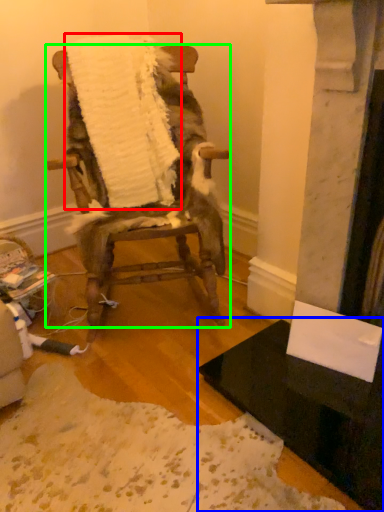
Question: Estimate the real-world distances between objects in this image. Which object is farther from blanket (highlighted by a red box), table (highlighted by a blue box) or chair (highlighted by a green box)?

Choices:
 (A) table
 (B) chair

Answer: (A)